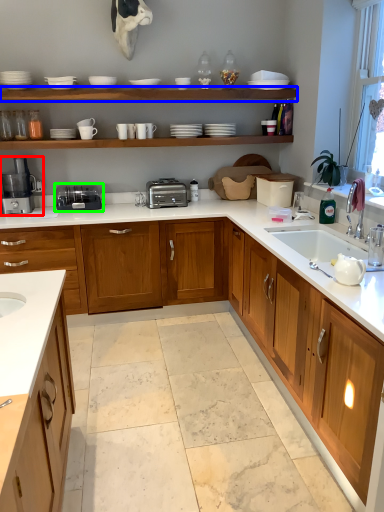
Question: Estimate the real-world distances between objects in this image. Which object is closer to coffee machine (highlighted by a red box), shelf (highlighted by a blue box) or appliance (highlighted by a green box)?

Choices:
 (A) shelf
 (B) appliance

Answer: (B)